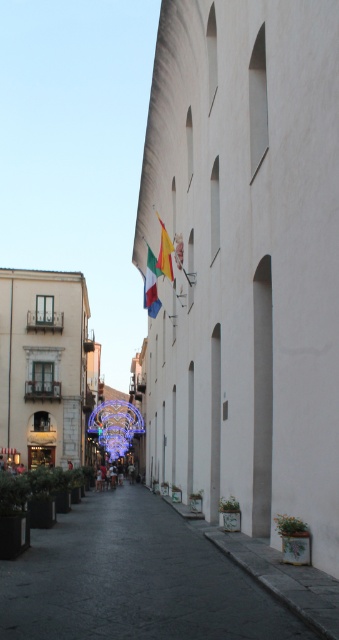
Is white fabric flag at center to the left of green leafy plant at lower right from the viewer's perspective?

Correct, you'll find white fabric flag at center to the left of green leafy plant at lower right.

Can you confirm if white fabric flag at center is bigger than green leafy plant at lower right?

Yes.

What do you see at coordinates (150, 284) in the screenshot? I see `white fabric flag at center` at bounding box center [150, 284].

The height and width of the screenshot is (640, 339). Identify the location of white fabric flag at center. click(150, 284).

Who is lower down, green leafy plant at lower right or green matte planter at lower center?

green matte planter at lower center is lower down.

Is green leafy plant at lower right above green matte planter at lower center?

Correct, green leafy plant at lower right is located above green matte planter at lower center.

At what (x,y) coordinates should I click in order to perform the action: click on green leafy plant at lower right. Please return your answer as a coordinate pair (x, y). Image resolution: width=339 pixels, height=640 pixels. Looking at the image, I should click on (289, 525).

You are a GUI agent. You are given a task and a screenshot of the screen. Output one action in this format:
    pyautogui.click(x=<x>, y=<y>)
    Task: Click on the green leafy plant at lower right
    Image resolution: width=339 pixels, height=640 pixels.
    Given the screenshot: What is the action you would take?
    (289, 525)

Who is lower down, white fabric flag at center or yellow-green fabric flag at center?

white fabric flag at center

The image size is (339, 640). I want to click on white fabric flag at center, so click(x=150, y=284).

Which is behind, point (151, 308) or point (164, 228)?

Point (151, 308)

Where is `white fabric flag at center`? white fabric flag at center is located at coordinates (150, 284).